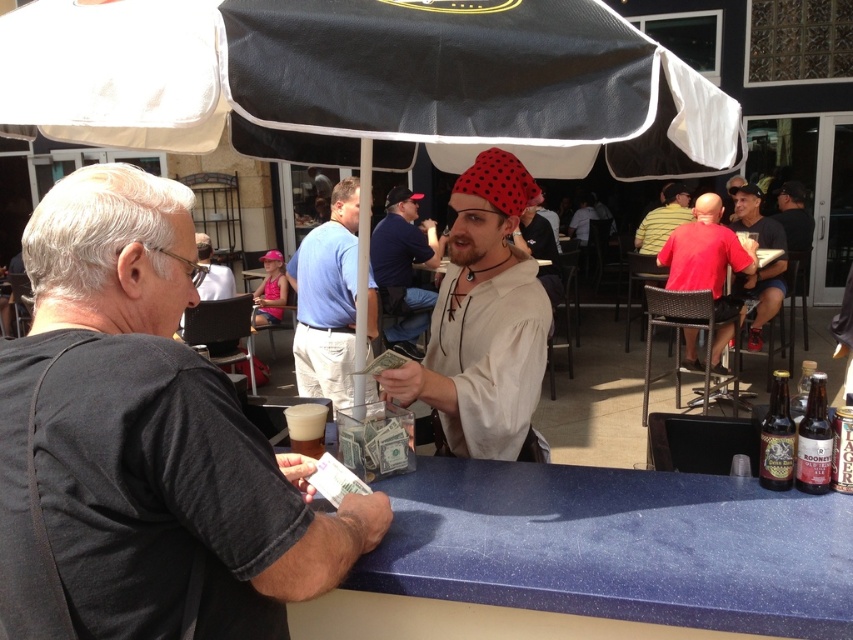
Question: Can you confirm if black fabric umbrella at upper center is bigger than dark gray t-shirt at center?

Choices:
 (A) no
 (B) yes

Answer: (B)

Question: Which point appears farthest from the camera in this image?

Choices:
 (A) (790, 417)
 (B) (751, 333)
 (C) (325, 416)

Answer: (B)

Question: Observing the image, what is the correct spatial positioning of blue cotton shirt at center in reference to matte black shirt at right?

Choices:
 (A) left
 (B) right

Answer: (A)

Question: Estimate the real-world distances between objects in this image. Which object is farther from the black fabric umbrella at upper center?

Choices:
 (A) blue cotton shirt at center
 (B) brown glass bottle at right

Answer: (A)

Question: Which of the following is the farthest from the observer?

Choices:
 (A) (36, 292)
 (B) (312, 448)
 (C) (786, 380)
 (D) (317, 273)

Answer: (D)

Question: Observing the image, what is the correct spatial positioning of dark blue shirt at center in reference to matte black shirt at right?

Choices:
 (A) above
 (B) below

Answer: (A)